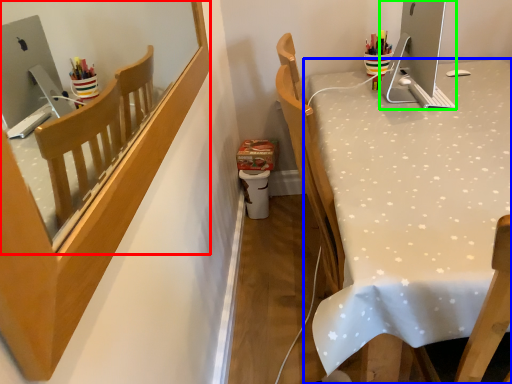
Question: Which is farther away from mirror (highlighted by a red box)? desk (highlighted by a blue box) or desktop (highlighted by a green box)?

Choices:
 (A) desk
 (B) desktop

Answer: (B)